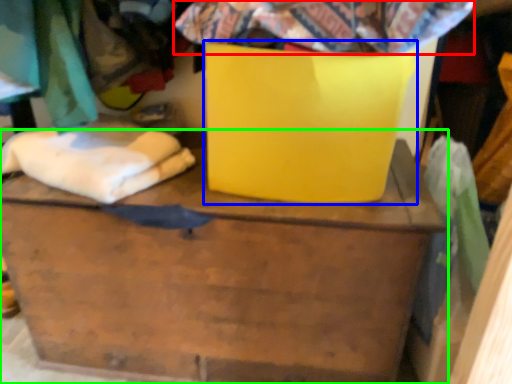
Question: Which object is positioned farthest from fabric (highlighted by a red box)? Select from cardboard box (highlighted by a blue box) and furniture (highlighted by a green box).

Choices:
 (A) cardboard box
 (B) furniture

Answer: (B)